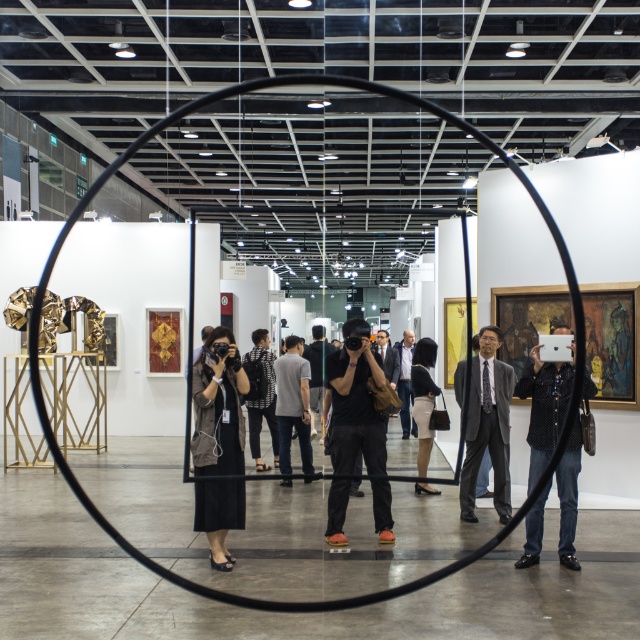
Does black leather skirt at center have a lesser width compared to dark gray fabric jacket at center?

Correct, black leather skirt at center's width is less than dark gray fabric jacket at center's.

What do you see at coordinates (424, 397) in the screenshot? I see `black leather skirt at center` at bounding box center [424, 397].

This screenshot has width=640, height=640. I want to click on black leather skirt at center, so click(424, 397).

Can you confirm if gray suit at center is positioned above black leather skirt at center?

Correct, gray suit at center is located above black leather skirt at center.

In the scene shown: Who is more distant from viewer, (x=508, y=500) or (x=420, y=403)?

The point (x=420, y=403) is behind.

What are the coordinates of `gray suit at center` in the screenshot? It's located at (486, 426).

Who is shorter, black leather skirt at center or matte black camera at center?

black leather skirt at center is shorter.

Is black leather skirt at center below matte black camera at center?

Actually, black leather skirt at center is above matte black camera at center.

What do you see at coordinates (424, 397) in the screenshot? I see `black leather skirt at center` at bounding box center [424, 397].

Where is `black leather skirt at center`? The image size is (640, 640). black leather skirt at center is located at coordinates (424, 397).